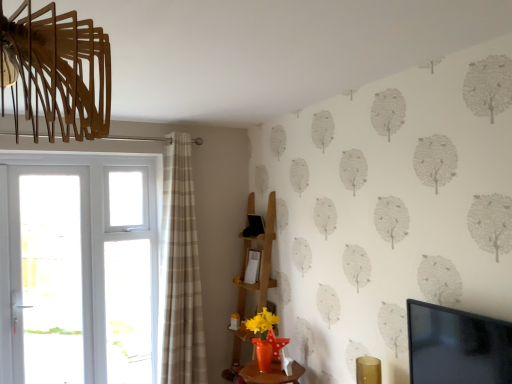
Looking at this image, measure the distance between point (x=58, y=282) and camera.

Point (x=58, y=282) is 3.00 meters away from camera.

Image resolution: width=512 pixels, height=384 pixels. I want to click on white plastic door at left, so click(78, 267).

In order to click on black glossy tv at upper right in this screenshot , I will do coord(457,346).

This screenshot has height=384, width=512. I want to click on white glass screen door at left, so click(x=50, y=274).

The image size is (512, 384). I want to click on white plastic door at left, so click(78, 267).

Between beige plaid curtain at left and white glass screen door at left, which one is positioned behind?

white glass screen door at left.

Looking at this image, from the image's perspective, between beige plaid curtain at left and white glass screen door at left, which one is located above?

beige plaid curtain at left is shown above in the image.

Is beige plaid curtain at left turned away from white glass screen door at left?

No, beige plaid curtain at left is not facing away from white glass screen door at left.

Is white glass screen door at left inside beige plaid curtain at left?

No.

Can you confirm if white plastic door at left is thinner than wooden shelf at center?

Correct, the width of white plastic door at left is less than that of wooden shelf at center.

Is white plastic door at left turned away from wooden shelf at center?

white plastic door at left is not turned away from wooden shelf at center.

Can you confirm if white plastic door at left is positioned to the right of wooden shelf at center?

In fact, white plastic door at left is to the left of wooden shelf at center.

Is white plastic door at left completely or partially outside of beige plaid curtain at left?

Yes.

Considering the relative sizes of white plastic door at left and beige plaid curtain at left in the image provided, is white plastic door at left wider than beige plaid curtain at left?

Incorrect, the width of white plastic door at left does not surpass that of beige plaid curtain at left.

Which object is positioned more to the left, white plastic door at left or beige plaid curtain at left?

Positioned to the left is white plastic door at left.

Is white plastic door at left in front of or behind beige plaid curtain at left in the image?

Clearly, white plastic door at left is behind beige plaid curtain at left.

From a real-world perspective, is white glass screen door at left located beneath wooden shelf at center?

No, from a real-world perspective, white glass screen door at left is not below wooden shelf at center.

Does white glass screen door at left appear on the right side of wooden shelf at center?

No.

Is white glass screen door at left facing away from wooden shelf at center?

No, white glass screen door at left is not facing away from wooden shelf at center.

Where is `shelf behind the white glass screen door at left`? shelf behind the white glass screen door at left is located at coordinates (260, 261).

Is black glossy tv at upper right inside beige plaid curtain at left?

No, beige plaid curtain at left does not contain black glossy tv at upper right.

How many degrees apart are the facing directions of beige plaid curtain at left and black glossy tv at upper right?

A: There is a 87.1-degree angle between the facing directions of beige plaid curtain at left and black glossy tv at upper right.

Could you tell me if beige plaid curtain at left is turned towards black glossy tv at upper right?

No, beige plaid curtain at left is not facing towards black glossy tv at upper right.

At what (x,y) coordinates should I click in order to perform the action: click on door that is behind the white glass screen door at left. Please return your answer as a coordinate pair (x, y). This screenshot has width=512, height=384. Looking at the image, I should click on (78, 267).

Which of these two, white plastic door at left or white glass screen door at left, is thinner?

With smaller width is white plastic door at left.

From the image's perspective, is white plastic door at left located above white glass screen door at left?

No, from the image's perspective, white plastic door at left is not on top of white glass screen door at left.

Between point (126, 218) and point (68, 379), which one is positioned in front?

The point (68, 379) is in front.

From a real-world perspective, is white plastic door at left above or below black glossy tv at upper right?

Clearly, from a real-world perspective, white plastic door at left is below black glossy tv at upper right.

How many degrees apart are the facing directions of white plastic door at left and black glossy tv at upper right?

88 degrees.

Consider the image. Is white plastic door at left aimed at black glossy tv at upper right?

Yes, white plastic door at left faces towards black glossy tv at upper right.

Is white plastic door at left at the right side of black glossy tv at upper right?

Incorrect, white plastic door at left is not on the right side of black glossy tv at upper right.

Where is `screen door below the beige plaid curtain at left (from a real-world perspective)`? This screenshot has height=384, width=512. screen door below the beige plaid curtain at left (from a real-world perspective) is located at coordinates (50, 274).

This screenshot has height=384, width=512. There is a wooden shelf at center. Find the location of `door above it (from a real-world perspective)`. door above it (from a real-world perspective) is located at coordinates (78, 267).

Considering their positions, is white plastic door at left positioned closer to black glossy tv at upper right than white glass screen door at left?

The object closer to black glossy tv at upper right is white plastic door at left.

Which object lies nearer to the anchor point beige plaid curtain at left, wooden shelf at center or white glass screen door at left?

wooden shelf at center is closer to beige plaid curtain at left.

From the image, which object appears to be farther from white plastic door at left, wooden shelf at center or black glossy tv at upper right?

Based on the image, black glossy tv at upper right appears to be further to white plastic door at left.

Which object lies further to the anchor point white glass screen door at left, white plastic door at left or wooden shelf at center?

wooden shelf at center.

Based on their spatial positions, is wooden shelf at center or white glass screen door at left closer to white plastic door at left?

white glass screen door at left lies closer to white plastic door at left than the other object.

Considering their positions, is beige plaid curtain at left positioned further to wooden shelf at center than black glossy tv at upper right?

black glossy tv at upper right.

Based on their spatial positions, is beige plaid curtain at left or wooden shelf at center closer to white plastic door at left?

beige plaid curtain at left is closer to white plastic door at left.

When comparing their distances from white glass screen door at left, does wooden shelf at center or white plastic door at left seem further?

Among the two, wooden shelf at center is located further to white glass screen door at left.

Where is `curtain located between white glass screen door at left and black glossy tv at upper right in the left-right direction`? The width and height of the screenshot is (512, 384). curtain located between white glass screen door at left and black glossy tv at upper right in the left-right direction is located at coordinates (180, 271).

I want to click on door between white glass screen door at left and black glossy tv at upper right from left to right, so click(x=78, y=267).

I want to click on door between white glass screen door at left and beige plaid curtain at left in the horizontal direction, so click(78, 267).

At what (x,y) coordinates should I click in order to perform the action: click on shelf between white glass screen door at left and black glossy tv at upper right in the horizontal direction. Please return your answer as a coordinate pair (x, y). This screenshot has width=512, height=384. Looking at the image, I should click on (260, 261).